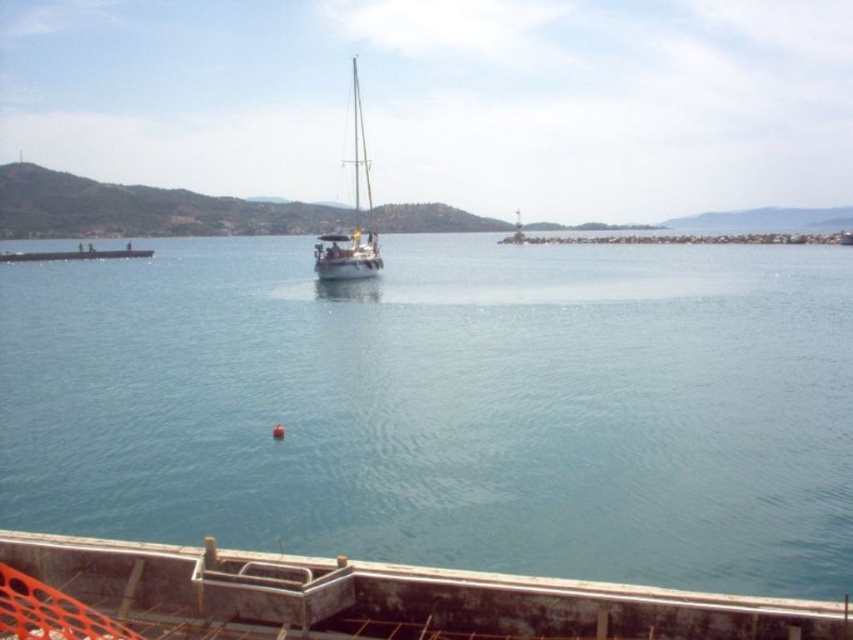
Is the position of clear blue water at center less distant than that of white glossy sailboat at center?

Yes, it is in front of white glossy sailboat at center.

What do you see at coordinates (445, 406) in the screenshot?
I see `clear blue water at center` at bounding box center [445, 406].

Which is in front, point (410, 324) or point (318, 276)?

Point (410, 324)

Locate an element on the screen. clear blue water at center is located at coordinates (445, 406).

Between clear blue water at center and concrete dock at lower center, which one has less height?

With less height is concrete dock at lower center.

Where is `clear blue water at center`? Image resolution: width=853 pixels, height=640 pixels. clear blue water at center is located at coordinates (445, 406).

Is point (415, 275) less distant than point (705, 602)?

No, (415, 275) is further to viewer.

Where is `clear blue water at center`? clear blue water at center is located at coordinates (445, 406).

Which is above, concrete dock at lower center or white glossy sailboat at center?

Positioned higher is white glossy sailboat at center.

The height and width of the screenshot is (640, 853). What do you see at coordinates (351, 600) in the screenshot?
I see `concrete dock at lower center` at bounding box center [351, 600].

I want to click on concrete dock at lower center, so pos(351,600).